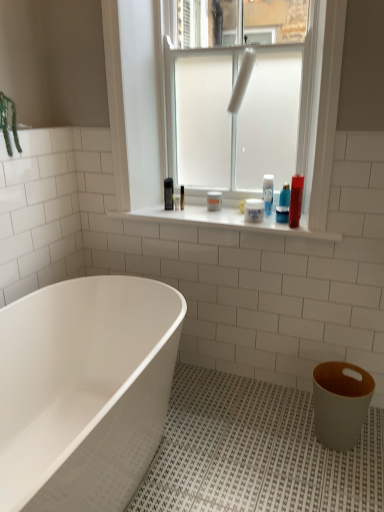
Question: Can you confirm if shiny plastic tube at upper right, marked as the 2th toiletry in a left-to-right arrangement, is thinner than white matte jar at center, the first toiletry from the left?

Choices:
 (A) no
 (B) yes

Answer: (B)

Question: Considering the relative sizes of shiny plastic tube at upper right, the first toiletry in the right-to-left sequence, and white matte jar at center, the 2th toiletry when ordered from right to left, in the image provided, is shiny plastic tube at upper right, the first toiletry in the right-to-left sequence, bigger than white matte jar at center, the 2th toiletry when ordered from right to left,?

Choices:
 (A) yes
 (B) no

Answer: (A)

Question: Is shiny plastic tube at upper right, marked as the 2th toiletry in a left-to-right arrangement, at the right side of white matte jar at center, the first toiletry from the left?

Choices:
 (A) yes
 (B) no

Answer: (A)

Question: From a real-world perspective, does shiny plastic tube at upper right, marked as the 2th toiletry in a left-to-right arrangement, stand above white matte jar at center, the 2th toiletry when ordered from right to left?

Choices:
 (A) yes
 (B) no

Answer: (A)

Question: Is shiny plastic tube at upper right, marked as the 2th toiletry in a left-to-right arrangement, positioned with its back to white matte jar at center, the first toiletry from the left?

Choices:
 (A) no
 (B) yes

Answer: (A)

Question: Is shiny plastic tube at upper right, the first toiletry in the right-to-left sequence, bigger or smaller than white matte jar at center, the 2th toiletry when ordered from right to left?

Choices:
 (A) big
 (B) small

Answer: (A)

Question: Is point (299, 212) closer or farther from the camera than point (261, 211)?

Choices:
 (A) farther
 (B) closer

Answer: (B)

Question: Considering the positions of shiny plastic tube at upper right, the first toiletry in the right-to-left sequence, and white matte jar at center, the first toiletry from the left, in the image, is shiny plastic tube at upper right, the first toiletry in the right-to-left sequence, wider or thinner than white matte jar at center, the first toiletry from the left,?

Choices:
 (A) wide
 (B) thin

Answer: (B)

Question: From a real-world perspective, relative to white matte jar at center, the 2th toiletry when ordered from right to left, is shiny plastic tube at upper right, marked as the 2th toiletry in a left-to-right arrangement, vertically above or below?

Choices:
 (A) below
 (B) above

Answer: (B)

Question: Looking at their shapes, would you say shiny plastic tube at upper right, the first toiletry in the right-to-left sequence, is wider or thinner than white glossy bathtub at lower left?

Choices:
 (A) thin
 (B) wide

Answer: (A)

Question: Relative to white glossy bathtub at lower left, is shiny plastic tube at upper right, the first toiletry in the right-to-left sequence, in front or behind?

Choices:
 (A) behind
 (B) front

Answer: (A)

Question: Looking at the image, does shiny plastic tube at upper right, marked as the 2th toiletry in a left-to-right arrangement, seem bigger or smaller compared to white glossy bathtub at lower left?

Choices:
 (A) big
 (B) small

Answer: (B)

Question: Is point (302, 177) closer or farther from the camera than point (71, 479)?

Choices:
 (A) farther
 (B) closer

Answer: (A)

Question: Would you say white frosted glass at center is to the left or to the right of clear glass window screen at upper center in the picture?

Choices:
 (A) left
 (B) right

Answer: (A)

Question: From a real-world perspective, relative to clear glass window screen at upper center, is white frosted glass at center vertically above or below?

Choices:
 (A) below
 (B) above

Answer: (A)